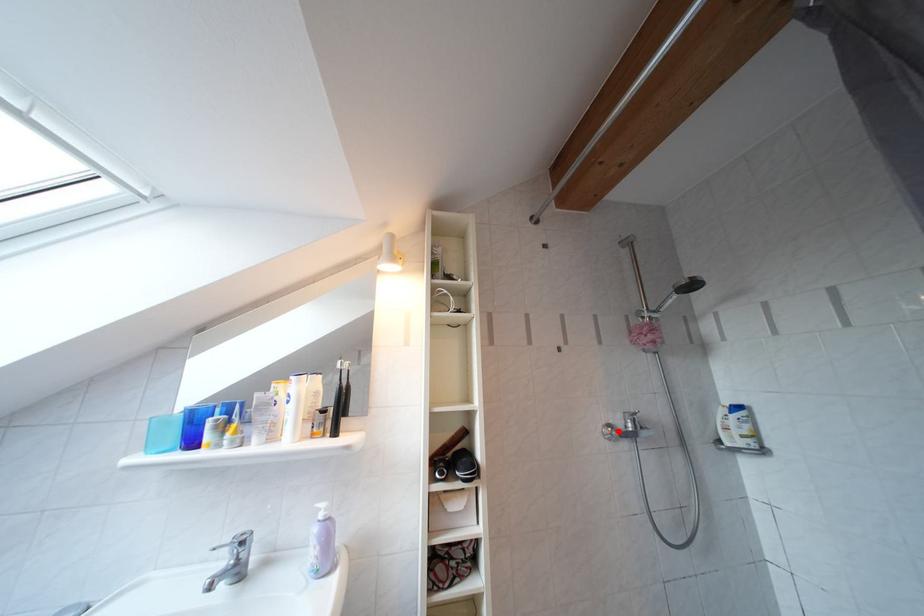
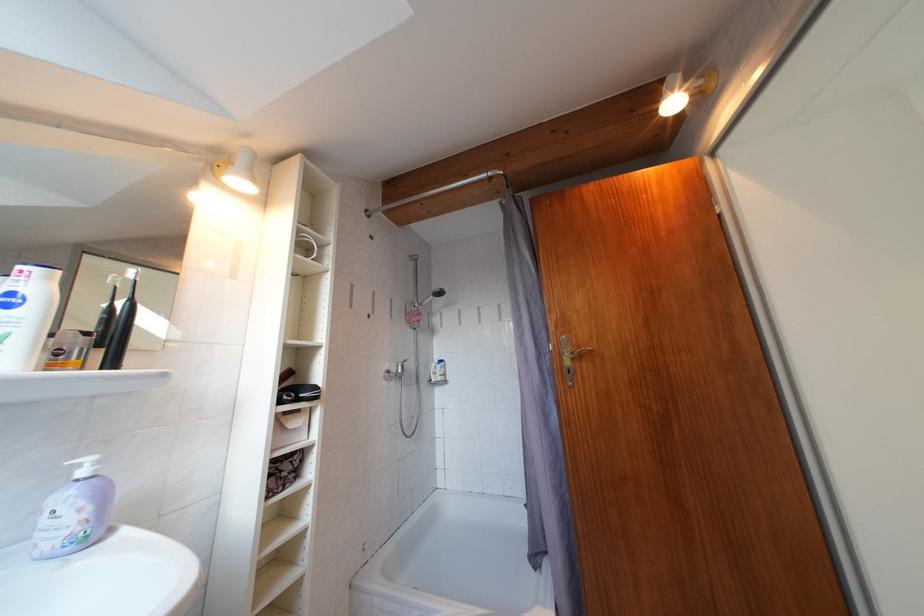
Where in the second image is the point corresponding to the highlighted location from the first image?

(396, 377)